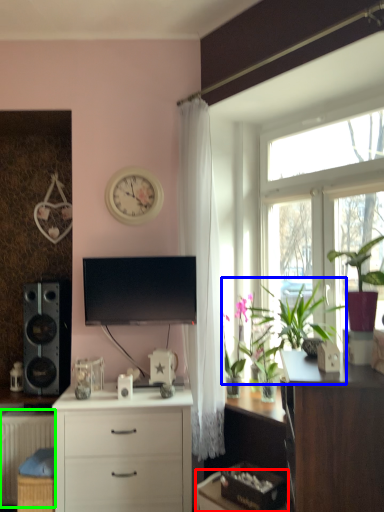
Question: Which object is positioned farthest from desk (highlighted by a red box)? Select from plant (highlighted by a blue box) and radiator (highlighted by a green box).

Choices:
 (A) plant
 (B) radiator

Answer: (B)